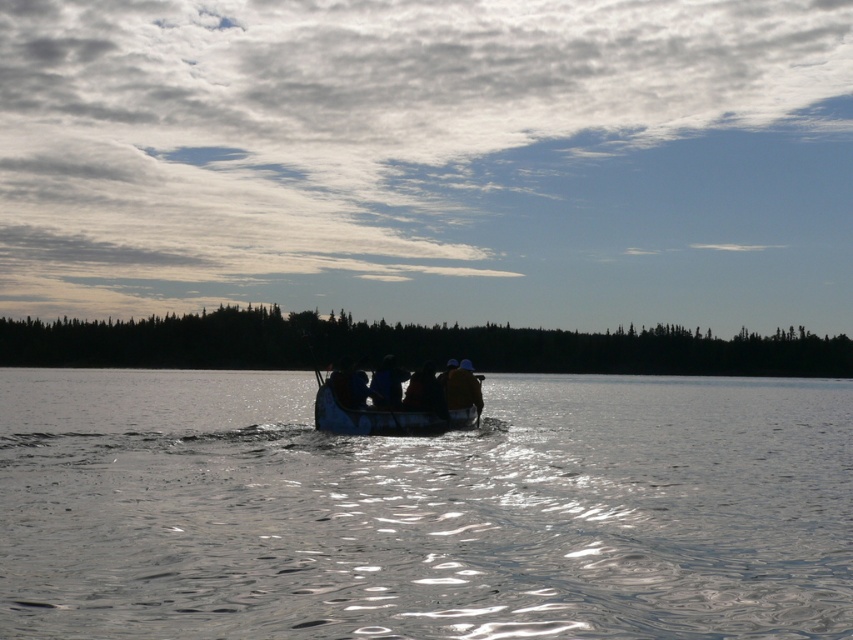
Question: Is brown leather jacket at center behind blue fabric at center?

Choices:
 (A) no
 (B) yes

Answer: (B)

Question: Which point appears farthest from the camera in this image?

Choices:
 (A) (459, 380)
 (B) (844, 456)

Answer: (B)

Question: Does brown leather jacket at center have a smaller size compared to blue fabric at center?

Choices:
 (A) no
 (B) yes

Answer: (A)

Question: Which is nearer to the brown wooden canoe at center?

Choices:
 (A) clear water at center
 (B) brown leather jacket at center
 (C) blue fabric at center

Answer: (C)

Question: Observing the image, what is the correct spatial positioning of clear water at center in reference to brown wooden canoe at center?

Choices:
 (A) above
 (B) below

Answer: (B)

Question: Which point is farther to the camera?

Choices:
 (A) blue fabric at center
 (B) brown leather jacket at center
 (C) clear water at center

Answer: (B)